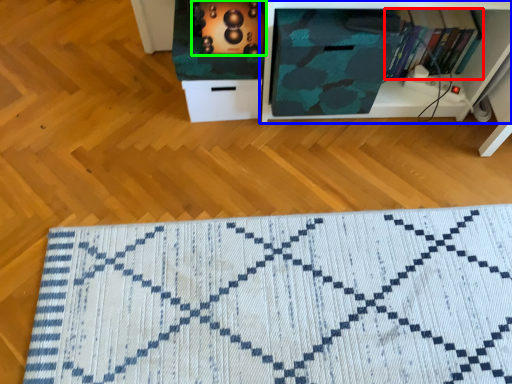
Question: Estimate the real-world distances between objects in this image. Which object is closer to book (highlighted by a red box), shelf (highlighted by a blue box) or appliance (highlighted by a green box)?

Choices:
 (A) shelf
 (B) appliance

Answer: (A)